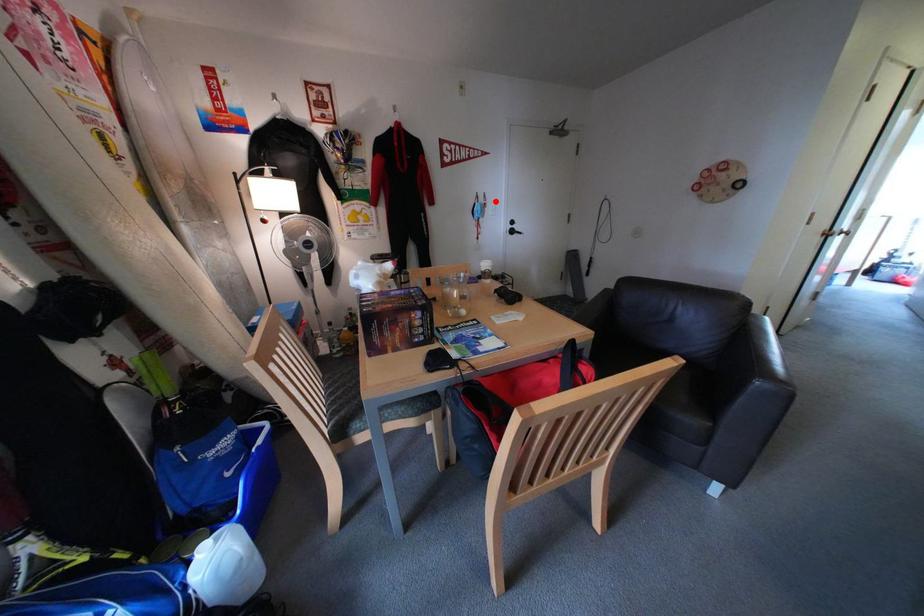
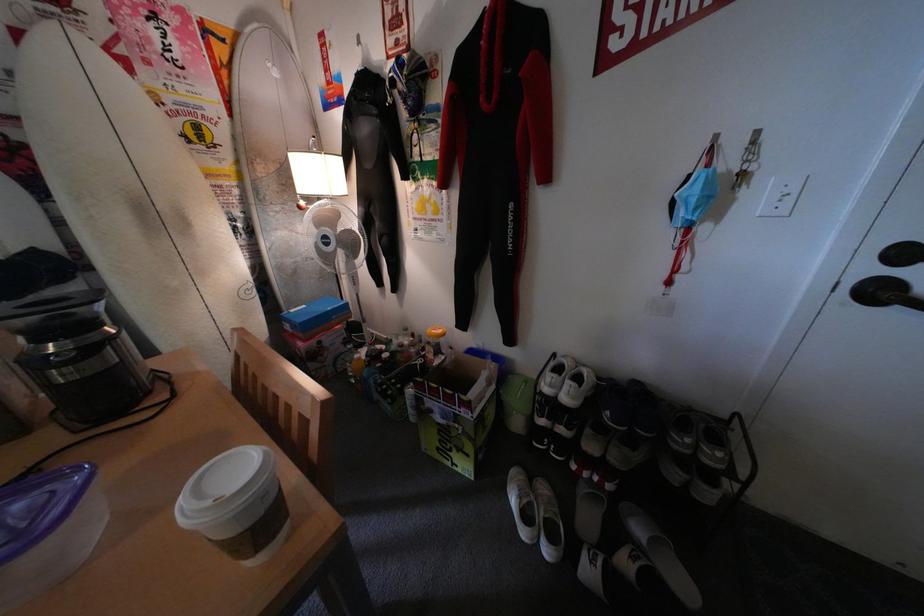
Question: I am providing you with two images of the same scene from different viewpoints. Given a red point in image1, look at the same physical point in image2. Is it:

Choices:
 (A) Closer to the viewpoint
 (B) Farther from the viewpoint

Answer: (B)